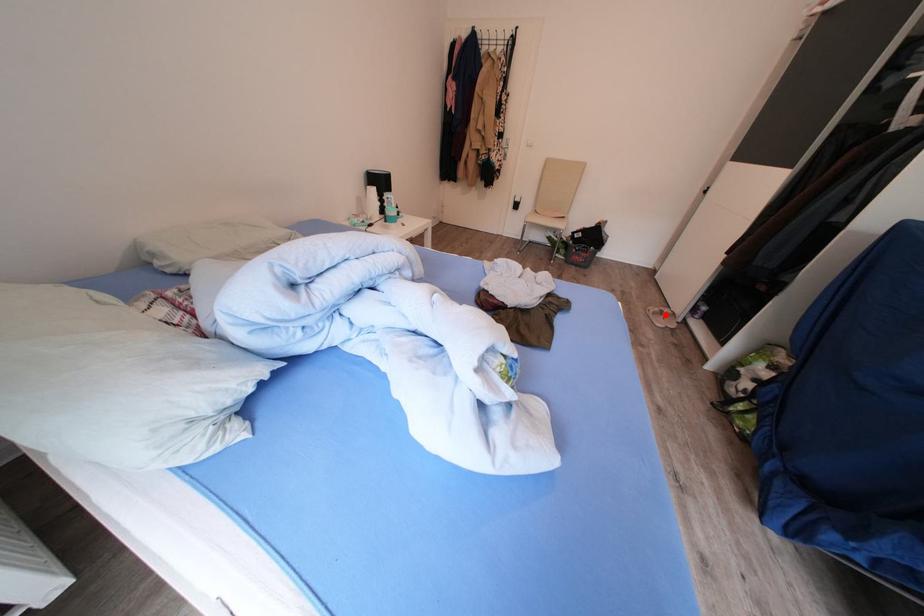
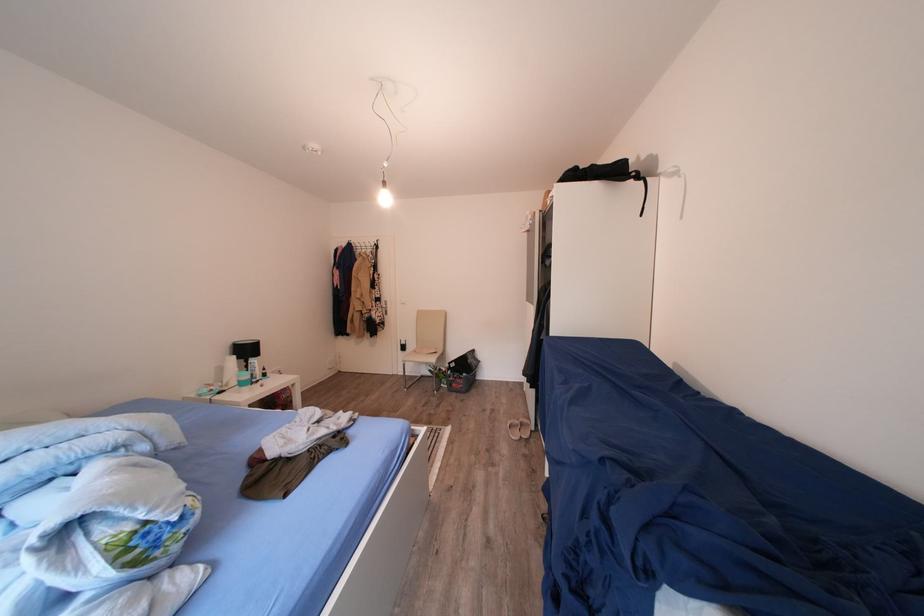
Question: I am providing you with two images of the same scene from different viewpoints. In image1, a red point is highlighted. Considering the same 3D point in image2, which of the following is correct?

Choices:
 (A) It is closer
 (B) It is farther

Answer: (A)